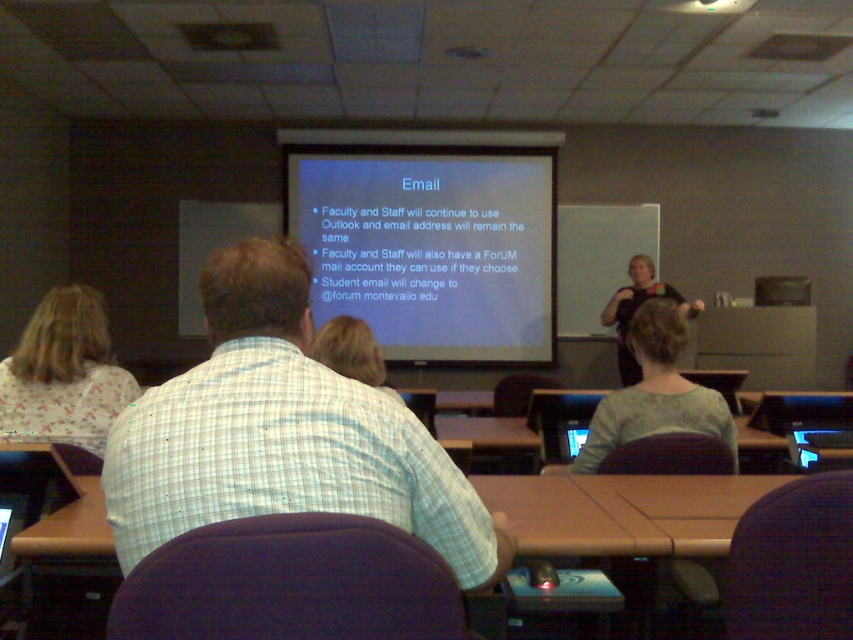
You are a student sitting at the brown wood table at center in the classroom. You need to hand a paper to the person wearing the gray fabric shirt at center. Can you reach them without leaving your seat?

The brown wood table at center is below gray fabric shirt at center, meaning the person with the gray fabric shirt at center is sitting at a higher elevation. Since the table is lower, you can likely reach them by extending your arm over the table.

Based on the photo, you are a student sitting at the brown wood table at center in the classroom. You want to look at the white matte projector screen at center without moving your head. Which direction should you turn your eyes?

The white matte projector screen at center is to the left of the brown wood table at center, so you should turn your eyes to the left to see it without moving your head.

You are a student entering the classroom and want to see the presentation on the white matte projector screen at center. You need to sit at the brown wood table at center. Which object should you face towards to see the presentation clearly?

You should face towards the white matte projector screen at center because it is much taller than the brown wood table at center, making it easier to see the presentation clearly from your seat.